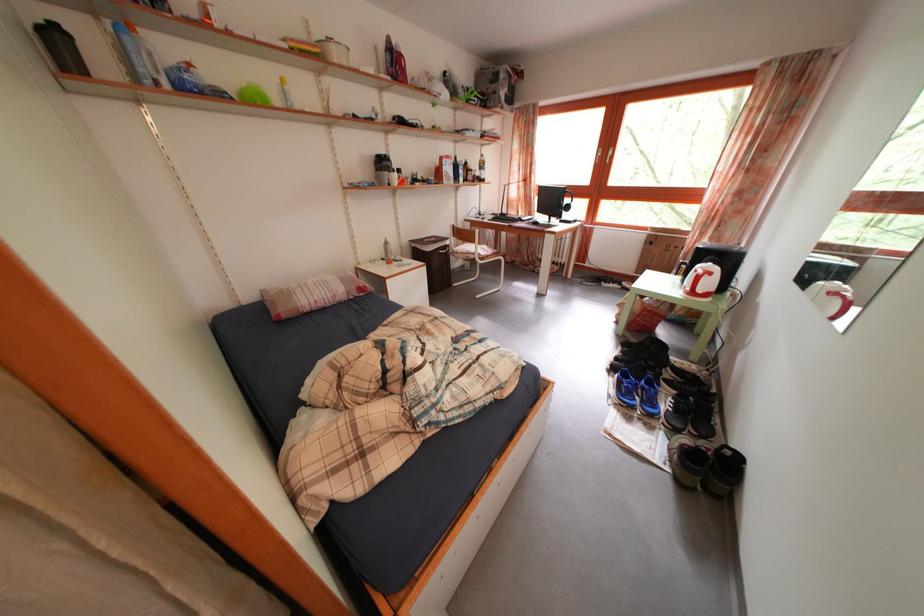
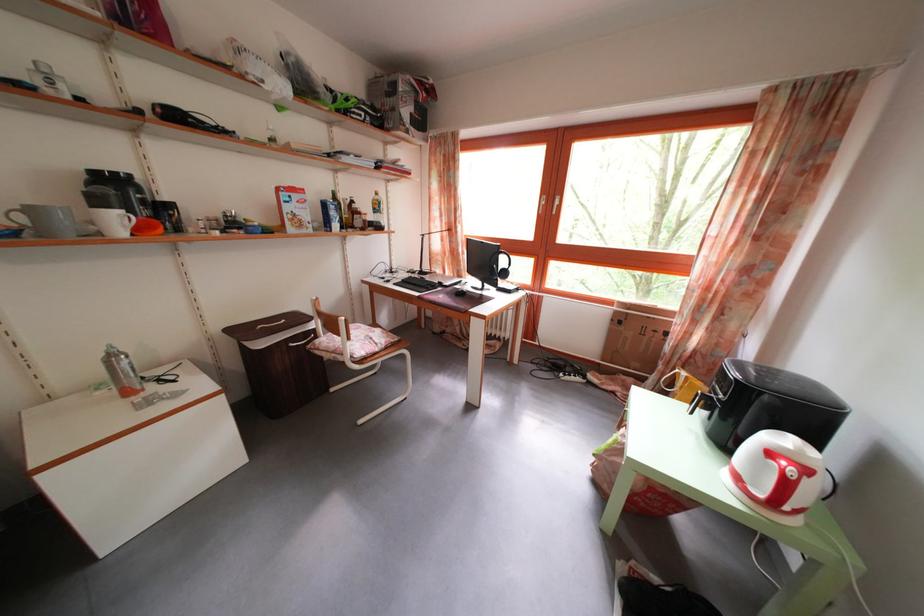
Find the pixel in the second image that matches point 402,185 in the first image.

(125, 227)